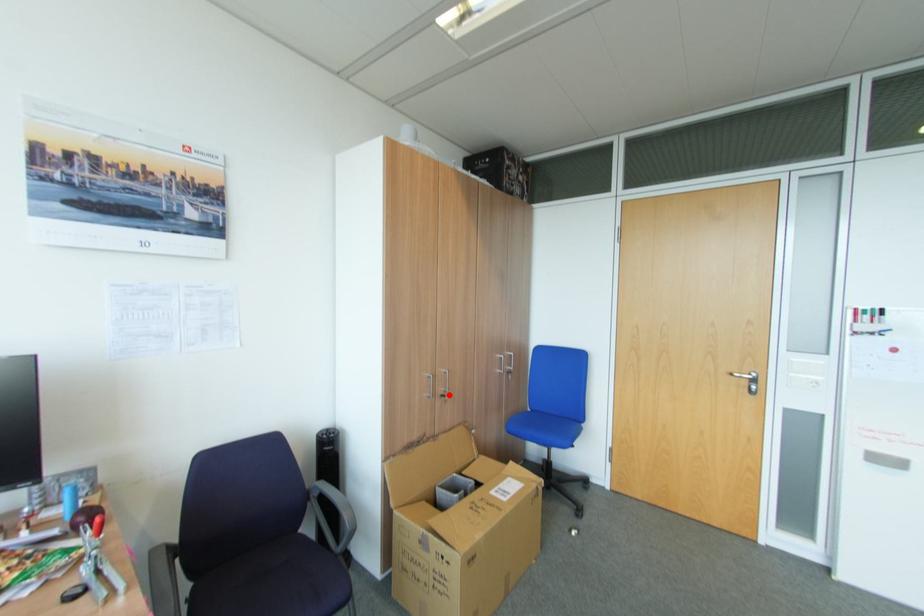
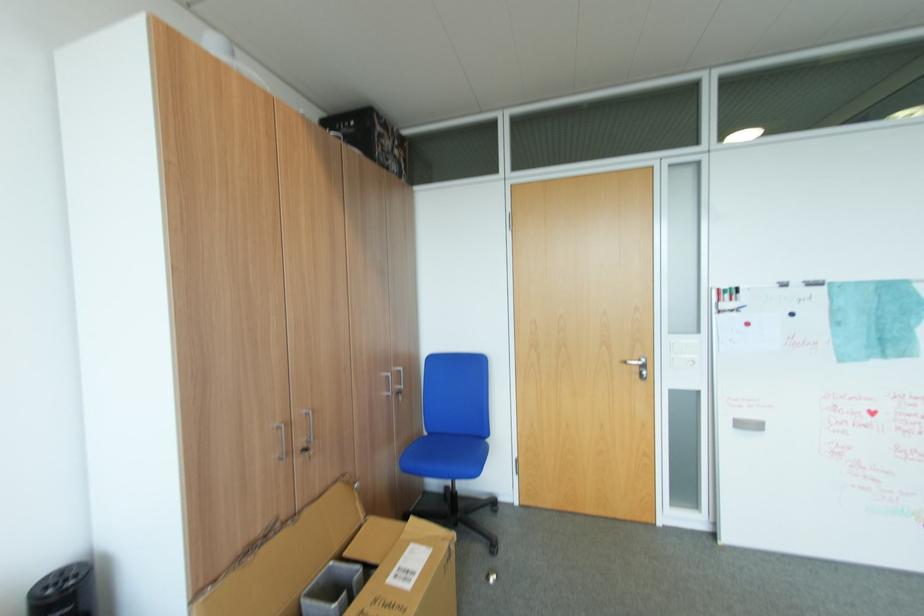
Find the pixel in the second image that matches the highlighted location in the first image.

(310, 451)